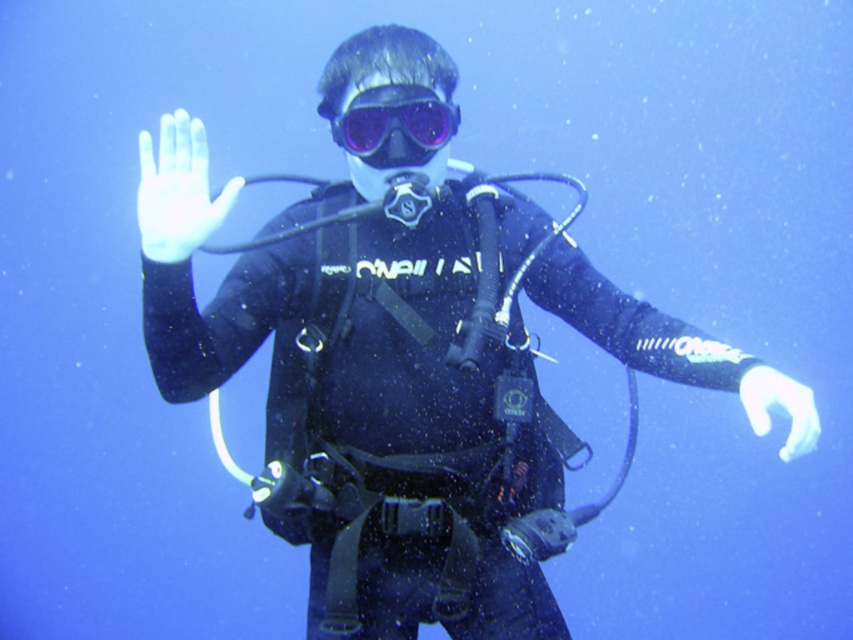
Question: Does transparent rubber mask at center have a greater width compared to white matte glove at center?

Choices:
 (A) yes
 (B) no

Answer: (B)

Question: Which object is the closest to the transparent rubber mask at center?

Choices:
 (A) purple matte/glossy goggles at center
 (B) white matte glove at center

Answer: (A)

Question: Among these points, which one is nearest to the camera?

Choices:
 (A) (345, 131)
 (B) (364, 154)

Answer: (B)

Question: Does transparent rubber mask at center have a greater width compared to white matte glove at center?

Choices:
 (A) no
 (B) yes

Answer: (A)

Question: Is transparent rubber mask at center positioned in front of white matte glove at lower right?

Choices:
 (A) no
 (B) yes

Answer: (A)

Question: Among these points, which one is nearest to the camera?

Choices:
 (A) (177, 212)
 (B) (346, 116)
 (C) (374, 134)
 (D) (817, 428)

Answer: (D)